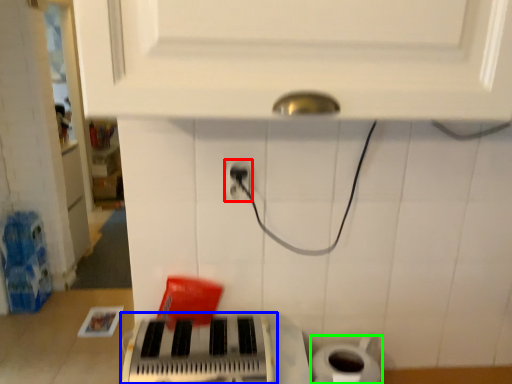
Question: Estimate the real-world distances between objects in this image. Which object is farther from power plugs and sockets (highlighted by a red box), musical keyboard (highlighted by a blue box) or toilet paper (highlighted by a green box)?

Choices:
 (A) musical keyboard
 (B) toilet paper

Answer: (B)